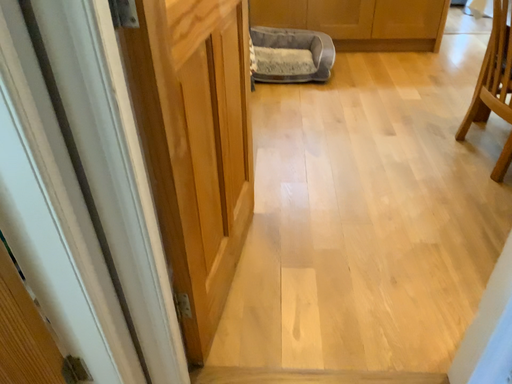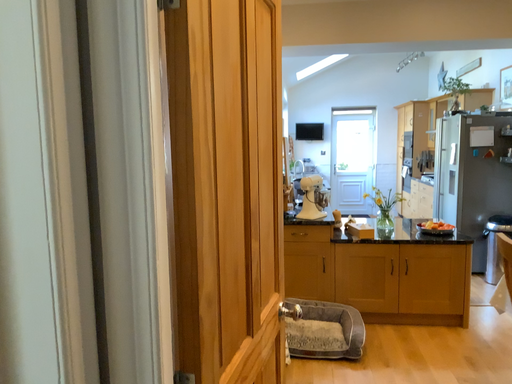
Question: How did the camera likely rotate when shooting the video?

Choices:
 (A) rotated upward
 (B) rotated downward

Answer: (A)